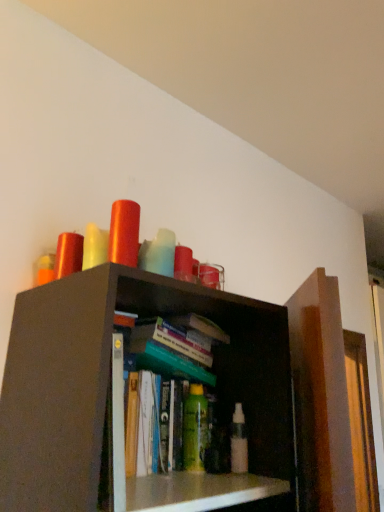
The width and height of the screenshot is (384, 512). Find the location of `green matte bottle at center, positioned as the first toiletry in left-to-right order`. green matte bottle at center, positioned as the first toiletry in left-to-right order is located at coordinates (195, 429).

This screenshot has height=512, width=384. Describe the element at coordinates (195, 429) in the screenshot. I see `green matte bottle at center, the second toiletry in the right-to-left sequence` at that location.

The image size is (384, 512). Describe the element at coordinates (239, 441) in the screenshot. I see `white plastic spray bottle at center, placed as the 2th toiletry when sorted from left to right` at that location.

At what (x,y) coordinates should I click in order to perform the action: click on white plastic spray bottle at center, which is counted as the first toiletry, starting from the right. Please return your answer as a coordinate pair (x, y). The width and height of the screenshot is (384, 512). Looking at the image, I should click on (239, 441).

In order to face white plastic spray bottle at center, placed as the 2th toiletry when sorted from left to right, should I rotate leftwards or rightwards?

You should look right and rotate roughly 6.382 degrees.

Identify the location of green matte bottle at center, the second toiletry in the right-to-left sequence. This screenshot has width=384, height=512. (195, 429).

From the picture: Would you say green matte bottle at center, the second toiletry in the right-to-left sequence, is to the left or to the right of white plastic spray bottle at center, which is counted as the first toiletry, starting from the right, in the picture?

Clearly, green matte bottle at center, the second toiletry in the right-to-left sequence, is on the left of white plastic spray bottle at center, which is counted as the first toiletry, starting from the right, in the image.

Which is in front, green matte bottle at center, the second toiletry in the right-to-left sequence, or white plastic spray bottle at center, placed as the 2th toiletry when sorted from left to right?

Positioned in front is white plastic spray bottle at center, placed as the 2th toiletry when sorted from left to right.

Is point (199, 448) farther from viewer compared to point (246, 438)?

No.

From the image's perspective, is green matte bottle at center, positioned as the first toiletry in left-to-right order, positioned above or below white plastic spray bottle at center, placed as the 2th toiletry when sorted from left to right?

Based on their image positions, green matte bottle at center, positioned as the first toiletry in left-to-right order, is located above white plastic spray bottle at center, placed as the 2th toiletry when sorted from left to right.

From a real-world perspective, is green matte bottle at center, positioned as the first toiletry in left-to-right order, physically above white plastic spray bottle at center, which is counted as the first toiletry, starting from the right?

Yes, from a real-world perspective, green matte bottle at center, positioned as the first toiletry in left-to-right order, is above white plastic spray bottle at center, which is counted as the first toiletry, starting from the right.

Does green matte bottle at center, positioned as the first toiletry in left-to-right order, have a greater width compared to white plastic spray bottle at center, placed as the 2th toiletry when sorted from left to right?

Yes.

Which of these two, green matte bottle at center, the second toiletry in the right-to-left sequence, or white plastic spray bottle at center, placed as the 2th toiletry when sorted from left to right, stands shorter?

white plastic spray bottle at center, placed as the 2th toiletry when sorted from left to right.

From the picture: Can you confirm if green matte bottle at center, the second toiletry in the right-to-left sequence, is bigger than white plastic spray bottle at center, which is counted as the first toiletry, starting from the right?

Indeed, green matte bottle at center, the second toiletry in the right-to-left sequence, has a larger size compared to white plastic spray bottle at center, which is counted as the first toiletry, starting from the right.

Would you say white plastic spray bottle at center, placed as the 2th toiletry when sorted from left to right, is part of green matte bottle at center, positioned as the first toiletry in left-to-right order,'s contents?

No, white plastic spray bottle at center, placed as the 2th toiletry when sorted from left to right, is located outside of green matte bottle at center, positioned as the first toiletry in left-to-right order.

Is green matte bottle at center, the second toiletry in the right-to-left sequence, placed right next to white plastic spray bottle at center, which is counted as the first toiletry, starting from the right?

Yes, green matte bottle at center, the second toiletry in the right-to-left sequence, is next to white plastic spray bottle at center, which is counted as the first toiletry, starting from the right.

Is green matte bottle at center, the second toiletry in the right-to-left sequence, oriented away from white plastic spray bottle at center, placed as the 2th toiletry when sorted from left to right?

No.

How different are the orientations of green matte bottle at center, the second toiletry in the right-to-left sequence, and white plastic spray bottle at center, placed as the 2th toiletry when sorted from left to right, in degrees?

The angular difference between green matte bottle at center, the second toiletry in the right-to-left sequence, and white plastic spray bottle at center, placed as the 2th toiletry when sorted from left to right, is 0.00379 degrees.

How much distance is there between green matte bottle at center, the second toiletry in the right-to-left sequence, and white plastic spray bottle at center, which is counted as the first toiletry, starting from the right?

They are 3.37 inches apart.

Image resolution: width=384 pixels, height=512 pixels. What are the coordinates of `toiletry located in front of the green matte bottle at center, positioned as the first toiletry in left-to-right order` in the screenshot? It's located at (239, 441).

Between white plastic spray bottle at center, which is counted as the first toiletry, starting from the right, and green matte bottle at center, positioned as the first toiletry in left-to-right order, which one appears on the right side from the viewer's perspective?

From the viewer's perspective, white plastic spray bottle at center, which is counted as the first toiletry, starting from the right, appears more on the right side.

Based on the photo, in the image, is white plastic spray bottle at center, which is counted as the first toiletry, starting from the right, positioned in front of or behind green matte bottle at center, the second toiletry in the right-to-left sequence?

Visually, white plastic spray bottle at center, which is counted as the first toiletry, starting from the right, is located in front of green matte bottle at center, the second toiletry in the right-to-left sequence.

Which point is more forward, (x=241, y=449) or (x=201, y=389)?

Positioned in front is point (x=241, y=449).

From the image's perspective, is white plastic spray bottle at center, which is counted as the first toiletry, starting from the right, over green matte bottle at center, the second toiletry in the right-to-left sequence?

Incorrect, from the image's perspective, white plastic spray bottle at center, which is counted as the first toiletry, starting from the right, is lower than green matte bottle at center, the second toiletry in the right-to-left sequence.

From a real-world perspective, who is located higher, white plastic spray bottle at center, placed as the 2th toiletry when sorted from left to right, or green matte bottle at center, the second toiletry in the right-to-left sequence?

green matte bottle at center, the second toiletry in the right-to-left sequence, is physically above.

In the scene shown: Between white plastic spray bottle at center, placed as the 2th toiletry when sorted from left to right, and green matte bottle at center, the second toiletry in the right-to-left sequence, which one has larger width?

With larger width is green matte bottle at center, the second toiletry in the right-to-left sequence.

Is white plastic spray bottle at center, placed as the 2th toiletry when sorted from left to right, taller than green matte bottle at center, positioned as the first toiletry in left-to-right order?

No.

Considering the sizes of objects white plastic spray bottle at center, placed as the 2th toiletry when sorted from left to right, and green matte bottle at center, the second toiletry in the right-to-left sequence, in the image provided, who is smaller, white plastic spray bottle at center, placed as the 2th toiletry when sorted from left to right, or green matte bottle at center, the second toiletry in the right-to-left sequence,?

With smaller size is white plastic spray bottle at center, placed as the 2th toiletry when sorted from left to right.

Is white plastic spray bottle at center, which is counted as the first toiletry, starting from the right, spatially inside green matte bottle at center, positioned as the first toiletry in left-to-right order, or outside of it?

white plastic spray bottle at center, which is counted as the first toiletry, starting from the right, is outside green matte bottle at center, positioned as the first toiletry in left-to-right order.

Is white plastic spray bottle at center, which is counted as the first toiletry, starting from the right, positioned far away from green matte bottle at center, positioned as the first toiletry in left-to-right order?

They are positioned close to each other.

Could you tell me if white plastic spray bottle at center, which is counted as the first toiletry, starting from the right, is turned towards green matte bottle at center, positioned as the first toiletry in left-to-right order?

No, white plastic spray bottle at center, which is counted as the first toiletry, starting from the right, is not turned towards green matte bottle at center, positioned as the first toiletry in left-to-right order.

What's the angular difference between white plastic spray bottle at center, placed as the 2th toiletry when sorted from left to right, and green matte bottle at center, positioned as the first toiletry in left-to-right order,'s facing directions?

0.00379 degrees separate the facing orientations of white plastic spray bottle at center, placed as the 2th toiletry when sorted from left to right, and green matte bottle at center, positioned as the first toiletry in left-to-right order.

I want to click on toiletry on the left side of white plastic spray bottle at center, placed as the 2th toiletry when sorted from left to right, so click(195, 429).

This screenshot has width=384, height=512. I want to click on toiletry lying below the green matte bottle at center, the second toiletry in the right-to-left sequence (from the image's perspective), so coord(239,441).

Identify the location of toiletry that appears on the right of green matte bottle at center, the second toiletry in the right-to-left sequence. (239, 441).